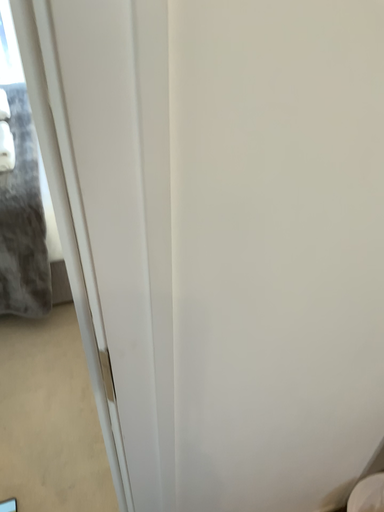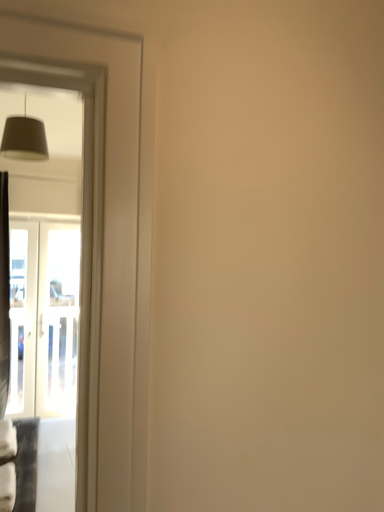
Question: How did the camera likely rotate when shooting the video?

Choices:
 (A) rotated downward
 (B) rotated upward

Answer: (B)